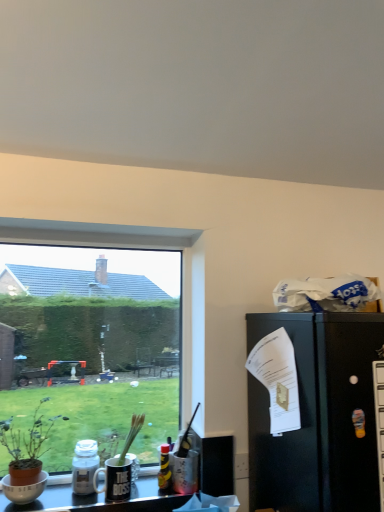
Question: Is brown terracotta pot at left further to camera compared to translucent glass bottle at lower left, which appears as the 2th bottle when viewed from the right?

Choices:
 (A) yes
 (B) no

Answer: (B)

Question: Is brown terracotta pot at left shorter than translucent glass bottle at lower left, which appears as the 2th bottle when viewed from the right?

Choices:
 (A) yes
 (B) no

Answer: (B)

Question: Does brown terracotta pot at left have a larger size compared to translucent glass bottle at lower left, the 1th bottle viewed from the left?

Choices:
 (A) no
 (B) yes

Answer: (B)

Question: From the image's perspective, is brown terracotta pot at left on top of translucent glass bottle at lower left, which appears as the 2th bottle when viewed from the right?

Choices:
 (A) yes
 (B) no

Answer: (A)

Question: From a real-world perspective, is brown terracotta pot at left on translucent glass bottle at lower left, the 1th bottle viewed from the left?

Choices:
 (A) no
 (B) yes

Answer: (B)

Question: Is brown terracotta pot at left taller or shorter than translucent glass bottle at lower left, the 1th bottle viewed from the left?

Choices:
 (A) short
 (B) tall

Answer: (B)

Question: Looking at their shapes, would you say brown terracotta pot at left is wider or thinner than translucent glass bottle at lower left, which appears as the 2th bottle when viewed from the right?

Choices:
 (A) thin
 (B) wide

Answer: (B)

Question: Is brown terracotta pot at left situated inside translucent glass bottle at lower left, which appears as the 2th bottle when viewed from the right, or outside?

Choices:
 (A) outside
 (B) inside

Answer: (A)

Question: Is brown terracotta pot at left to the left or to the right of translucent glass bottle at lower left, which appears as the 2th bottle when viewed from the right, in the image?

Choices:
 (A) right
 (B) left

Answer: (B)

Question: From the image's perspective, relative to matte white bowl at lower left, is translucent plastic bottle at center, placed as the second bottle when sorted from left to right, above or below?

Choices:
 (A) above
 (B) below

Answer: (A)

Question: Would you say translucent plastic bottle at center, placed as the second bottle when sorted from left to right, is to the left or to the right of matte white bowl at lower left in the picture?

Choices:
 (A) left
 (B) right

Answer: (B)

Question: Looking at the image, does translucent plastic bottle at center, arranged as the 1th bottle when viewed from the right, seem bigger or smaller compared to matte white bowl at lower left?

Choices:
 (A) big
 (B) small

Answer: (B)

Question: From a real-world perspective, is translucent plastic bottle at center, arranged as the 1th bottle when viewed from the right, positioned above or below matte white bowl at lower left?

Choices:
 (A) above
 (B) below

Answer: (A)

Question: Looking at the image, does translucent plastic bottle at center, arranged as the 1th bottle when viewed from the right, seem bigger or smaller compared to transparent glass window at lower left?

Choices:
 (A) small
 (B) big

Answer: (A)

Question: Is translucent plastic bottle at center, arranged as the 1th bottle when viewed from the right, to the left or to the right of transparent glass window at lower left in the image?

Choices:
 (A) right
 (B) left

Answer: (A)